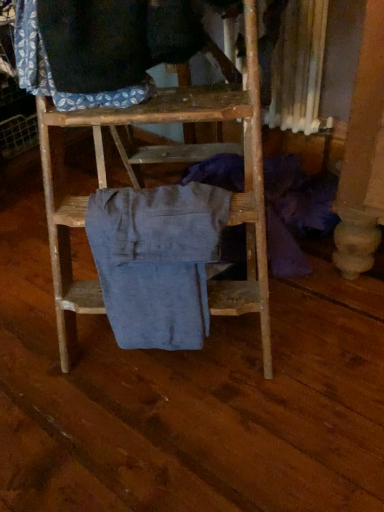
Question: From their relative heights in the image, would you say blue patterned fabric at upper left, which ranks as the first clothing in top-to-bottom order, is taller or shorter than denim pants at center, which is counted as the 2th clothing, starting from the top?

Choices:
 (A) tall
 (B) short

Answer: (B)

Question: Is blue patterned fabric at upper left, the first clothing when ordered from left to right, bigger or smaller than denim pants at center, the first clothing positioned from the right?

Choices:
 (A) big
 (B) small

Answer: (B)

Question: In terms of width, does blue patterned fabric at upper left, placed as the second clothing when sorted from right to left, look wider or thinner when compared to denim pants at center, the first clothing positioned from the right?

Choices:
 (A) wide
 (B) thin

Answer: (B)

Question: Is point (180, 186) closer or farther from the camera than point (117, 83)?

Choices:
 (A) closer
 (B) farther

Answer: (B)

Question: From the image's perspective, is denim pants at center, the 2th clothing when ordered from left to right, located above or below blue patterned fabric at upper left, the first clothing when ordered from left to right?

Choices:
 (A) above
 (B) below

Answer: (B)

Question: Considering their positions, is denim pants at center, the first clothing positioned from the right, located in front of or behind blue patterned fabric at upper left, the first clothing when ordered from left to right?

Choices:
 (A) behind
 (B) front

Answer: (A)

Question: Is denim pants at center, the first clothing positioned from the right, bigger or smaller than blue patterned fabric at upper left, placed as the second clothing when sorted from right to left?

Choices:
 (A) big
 (B) small

Answer: (A)